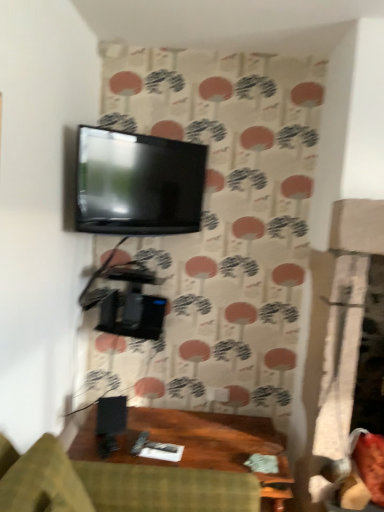
Question: In the image, is green fabric studio couch at lower center on the left side or the right side of matte black tv at upper center?

Choices:
 (A) left
 (B) right

Answer: (B)

Question: In terms of width, does green fabric studio couch at lower center look wider or thinner when compared to matte black tv at upper center?

Choices:
 (A) wide
 (B) thin

Answer: (A)

Question: Based on their relative distances, which object is farther from the black matte speaker at lower center?

Choices:
 (A) matte black tv at upper center
 (B) green fabric studio couch at lower center
 (C) leather swivel chair at lower right

Answer: (C)

Question: Estimate the real-world distances between objects in this image. Which object is farther from the matte black tv at upper center?

Choices:
 (A) green fabric studio couch at lower center
 (B) leather swivel chair at lower right
 (C) black matte speaker at lower center

Answer: (B)